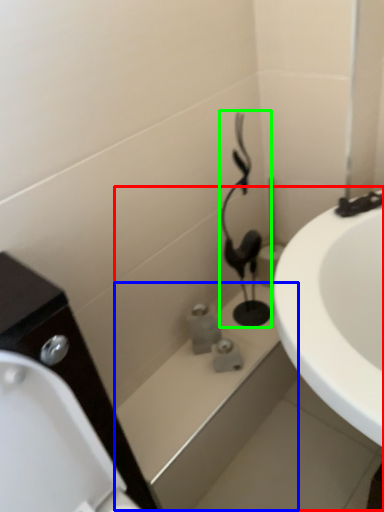
Question: Estimate the real-world distances between objects in this image. Which object is farther from bath (highlighted by a red box), bath (highlighted by a blue box) or plumbing fixture (highlighted by a green box)?

Choices:
 (A) bath
 (B) plumbing fixture

Answer: (B)